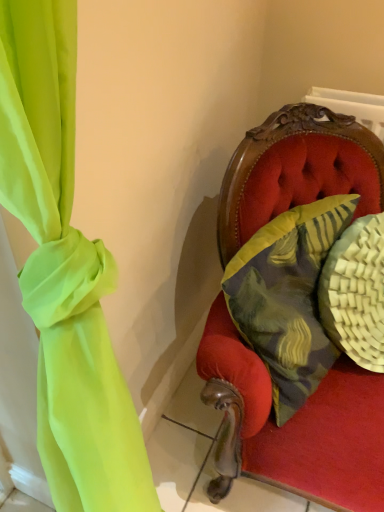
What do you see at coordinates (287, 297) in the screenshot? This screenshot has width=384, height=512. I see `textured yellow pillow at right` at bounding box center [287, 297].

Where is `textured yellow pillow at right`? Image resolution: width=384 pixels, height=512 pixels. textured yellow pillow at right is located at coordinates (287, 297).

What is the approximate width of textured yellow pillow at right?

textured yellow pillow at right is 22.37 centimeters in width.

The height and width of the screenshot is (512, 384). I want to click on textured yellow pillow at right, so click(x=287, y=297).